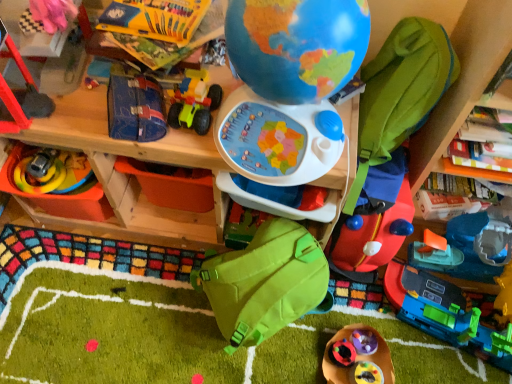
Find the location of a particular element. The width and height of the screenshot is (512, 384). free point in front of matte plastic crayons at upper left, the eighth toy viewed from the right is located at coordinates (150, 46).